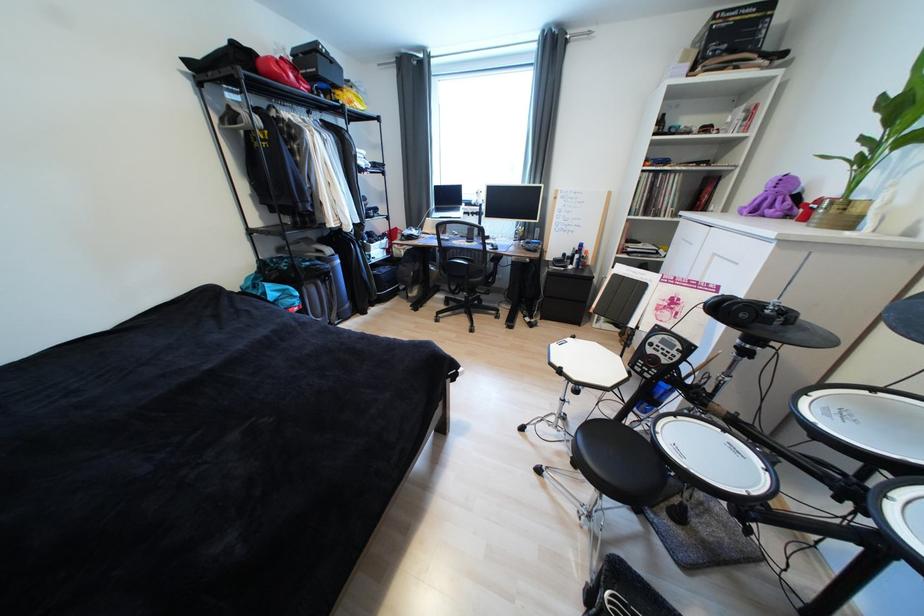
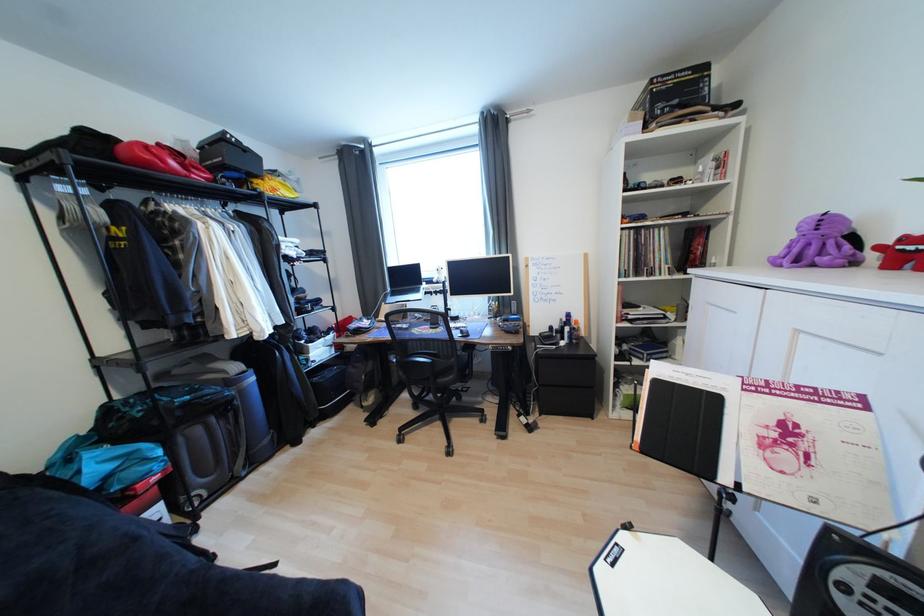
Question: In a continuous first-person perspective shot, in which direction is the camera moving?

Choices:
 (A) Left
 (B) Right
 (C) Forward
 (D) Backward

Answer: (C)